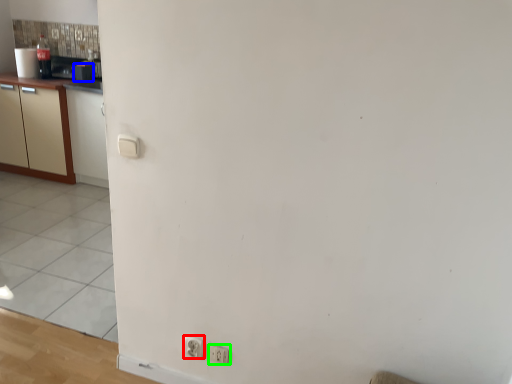
Question: Based on their relative distances, which object is nearer to electric outlet (highlighted by a red box)? Choose from appliance (highlighted by a blue box) and electric outlet (highlighted by a green box).

Choices:
 (A) appliance
 (B) electric outlet

Answer: (B)